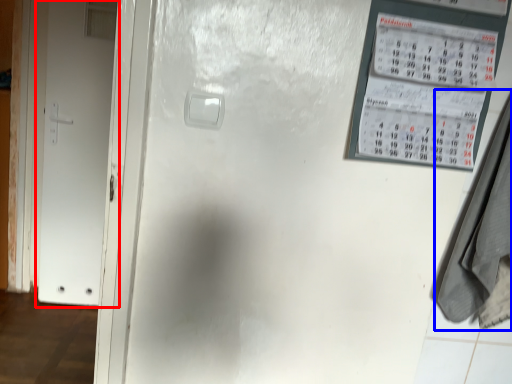
Question: Which point is closer to the camera, door (highlighted by a red box) or laundry (highlighted by a blue box)?

Choices:
 (A) door
 (B) laundry

Answer: (B)